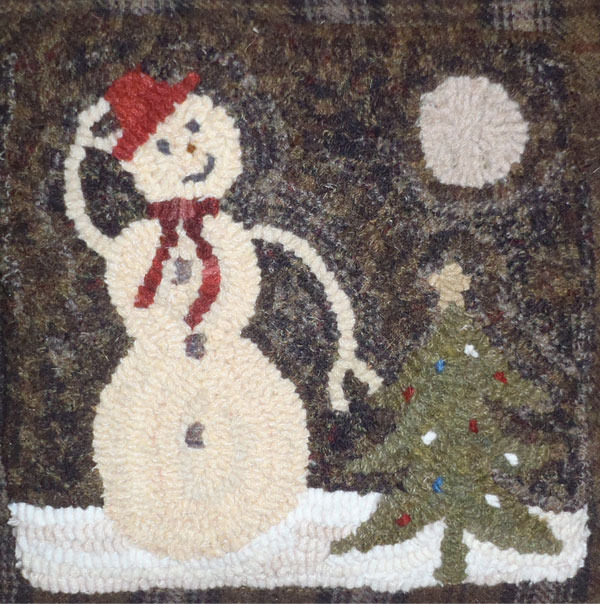
Find the location of a particular element. This screenshot has height=604, width=600. white light is located at coordinates (469, 347), (428, 437), (515, 455), (493, 496).